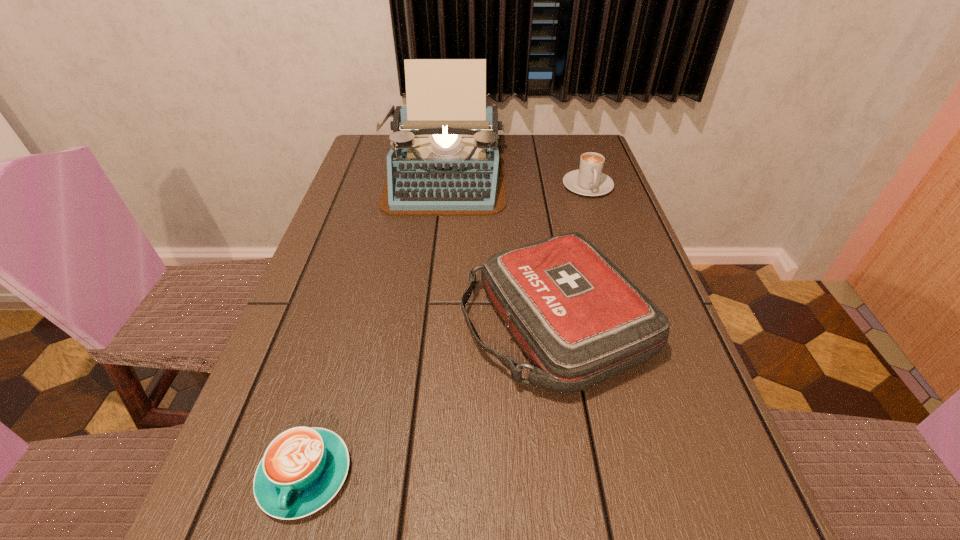
Where is `typewriter`? This screenshot has height=540, width=960. typewriter is located at coordinates (445, 160).

Where is `the first-aid kit`? This screenshot has height=540, width=960. the first-aid kit is located at coordinates (580, 320).

At what (x,y) coordinates should I click in order to perform the action: click on the third shortest object. Please return your answer as a coordinate pair (x, y). Looking at the image, I should click on coord(580,320).

This screenshot has height=540, width=960. Find the location of `the taller cappuccino`. the taller cappuccino is located at coordinates (588, 180).

Find the location of a particular element. the third tallest object is located at coordinates (588, 180).

Identify the location of the shorter cappuccino. This screenshot has height=540, width=960. (303, 468).

Find the location of a particular element. the left cappuccino is located at coordinates (303, 468).

Image resolution: width=960 pixels, height=540 pixels. I want to click on vacant space located on the typing side of the tallest object, so click(436, 248).

Where is `vacant position located 0.050m on the front of the first-aid kit`? vacant position located 0.050m on the front of the first-aid kit is located at coordinates (573, 434).

At what (x,y) coordinates should I click in order to perform the action: click on free space located to the right of the second shortest object. Please return your answer as a coordinate pair (x, y). This screenshot has height=540, width=960. Looking at the image, I should click on (597, 214).